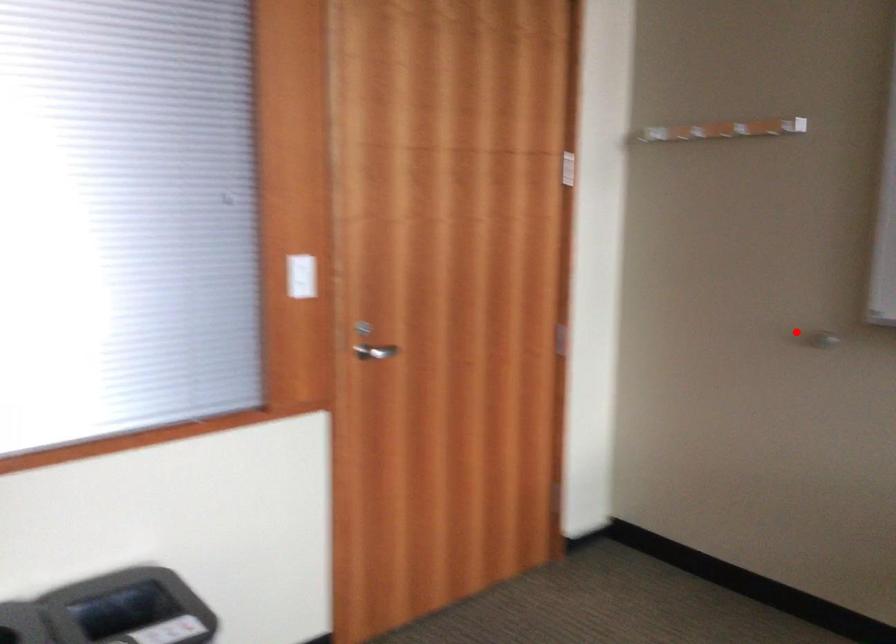
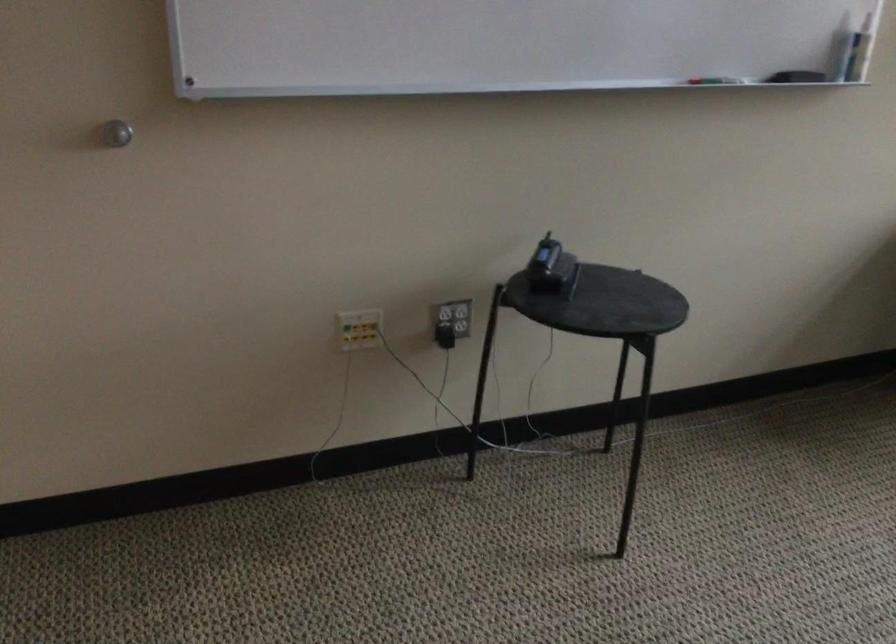
Question: A red point is marked in image1. In image2, is the corresponding 3D point closer to the camera or farther? Reply with the corresponding letter.

Choices:
 (A) The corresponding 3D point is closer.
 (B) The corresponding 3D point is farther.

Answer: (A)